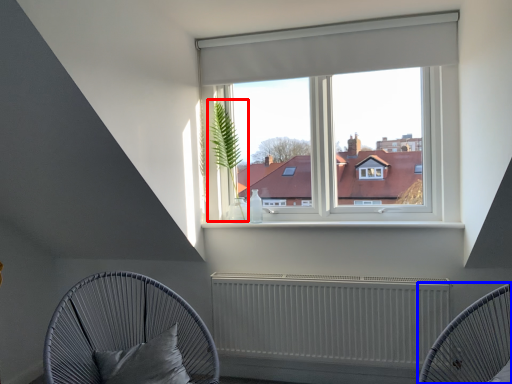
Question: Which point is further to the camera, plant (highlighted by a red box) or furniture (highlighted by a blue box)?

Choices:
 (A) plant
 (B) furniture

Answer: (A)